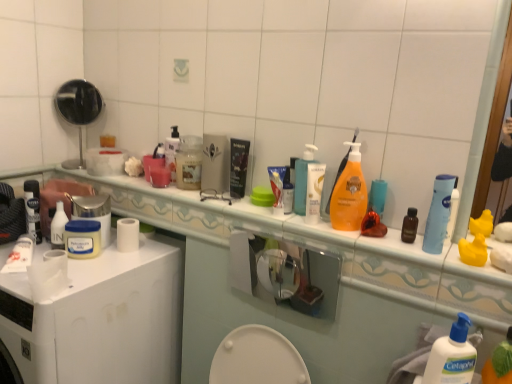
Question: Is translucent plastic tube at center, the second toiletry from the right, a part of white plastic jar at upper left, arranged as the second mouthwash when viewed from the back?

Choices:
 (A) yes
 (B) no

Answer: (B)

Question: Is white plastic jar at upper left, acting as the third mouthwash starting from the right, facing towards translucent plastic tube at center, the 2th toiletry viewed from the left?

Choices:
 (A) yes
 (B) no

Answer: (B)

Question: From the image's perspective, is white plastic jar at upper left, the 1th mouthwash viewed from the left, beneath translucent plastic tube at center, the second toiletry from the right?

Choices:
 (A) yes
 (B) no

Answer: (A)

Question: Considering the relative sizes of white plastic jar at upper left, the 1th mouthwash viewed from the left, and translucent plastic tube at center, which appears as the 2th toiletry when viewed from the back, in the image provided, is white plastic jar at upper left, the 1th mouthwash viewed from the left, taller than translucent plastic tube at center, which appears as the 2th toiletry when viewed from the back,?

Choices:
 (A) no
 (B) yes

Answer: (A)

Question: From the image's perspective, is white plastic container at center above or below translucent plastic jar at center, which is the 2th mouthwash from left to right?

Choices:
 (A) below
 (B) above

Answer: (A)

Question: Visually, is white plastic container at center positioned to the left or to the right of translucent plastic jar at center, the 1th mouthwash when ordered from back to front?

Choices:
 (A) left
 (B) right

Answer: (A)

Question: Is point (86, 211) positioned closer to the camera than point (194, 175)?

Choices:
 (A) closer
 (B) farther

Answer: (A)

Question: In terms of width, does white plastic container at center look wider or thinner when compared to translucent plastic jar at center, which is the 2th mouthwash from left to right?

Choices:
 (A) thin
 (B) wide

Answer: (B)

Question: Is translucent plastic pump bottle at center, which is the first cleaning product in left-to-right order, in front of or behind blue plastic tube at upper right, which ranks as the 3th mouthwash in left-to-right order, in the image?

Choices:
 (A) front
 (B) behind

Answer: (B)

Question: From their relative heights in the image, would you say translucent plastic pump bottle at center, which appears as the third cleaning product when viewed from the front, is taller or shorter than blue plastic tube at upper right, the first mouthwash viewed from the right?

Choices:
 (A) short
 (B) tall

Answer: (B)

Question: In the image, is translucent plastic pump bottle at center, the 1th cleaning product when ordered from back to front, on the left side or the right side of blue plastic tube at upper right, positioned as the third mouthwash in back-to-front order?

Choices:
 (A) right
 (B) left

Answer: (B)

Question: Is translucent plastic pump bottle at center, the 2th cleaning product when ordered from bottom to top, inside or outside of blue plastic tube at upper right, positioned as the third mouthwash in back-to-front order?

Choices:
 (A) outside
 (B) inside

Answer: (A)

Question: Relative to white glossy counter top at upper center, is white pump bottle at center right, acting as the third cleaning product starting from the top, in front or behind?

Choices:
 (A) behind
 (B) front

Answer: (B)

Question: From a real-world perspective, is white pump bottle at center right, the 1th cleaning product viewed from the front, positioned above or below white glossy counter top at upper center?

Choices:
 (A) above
 (B) below

Answer: (B)